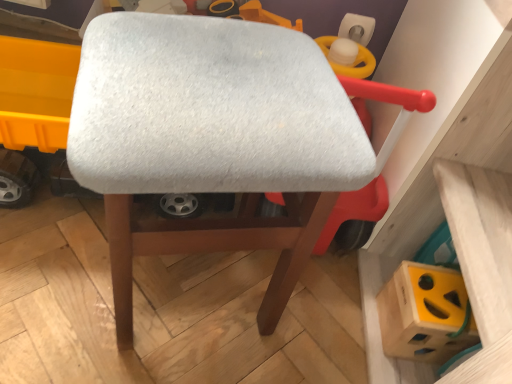
This screenshot has width=512, height=384. In order to click on free space above textured fabric chair at center (from a real-world perspective) in this screenshot , I will do `click(214, 70)`.